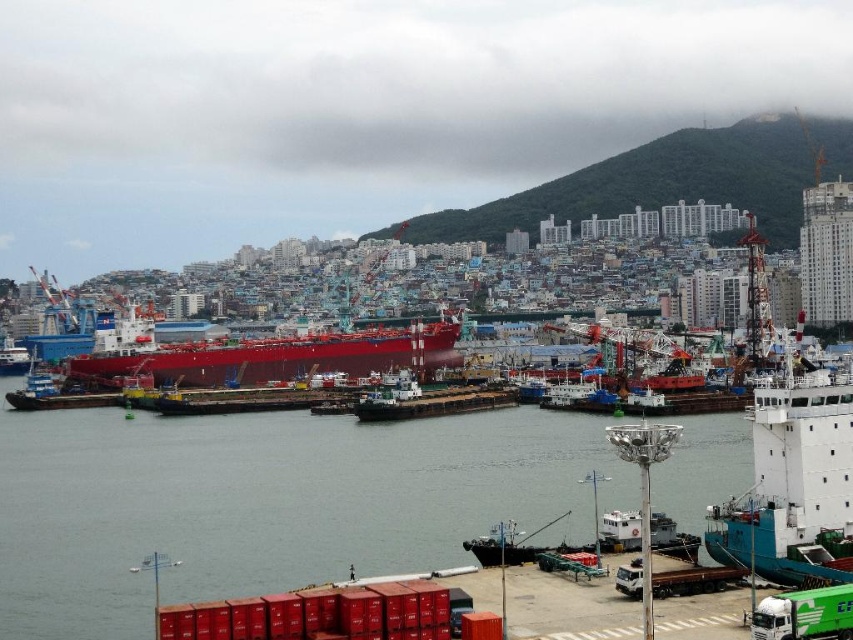
You are a port authority inspector assessing the port layout. You notice the transparent water at center and the white matte ship at right. Based on their widths, which one is wider?

The transparent water at center is wider than the white matte ship at right according to the description.

You are a port authority inspector tasked with ensuring vessel spacing. You observe the white matte ship at right and the glossy red ship at center in the port. Based on their sizes, which vessel requires more space to maneuver safely?

The white matte ship at right requires more space to maneuver safely because it has a larger size compared to the glossy red ship at center.

Based on the photo, you are standing at the center of the dock area in the port scene. You need to locate the white matte ship at right. According to the coordinates provided, in which direction should you look to find it?

The white matte ship at right is located at coordinates point (793, 483), so you should look to the right side of the scene to find it.